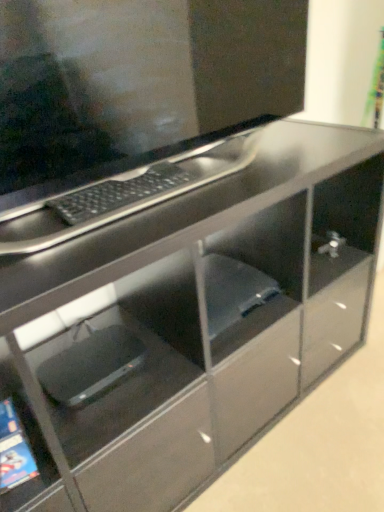
Identify the location of vacant space underneath matte black monitor at upper center (from a real-world perspective). (217, 167).